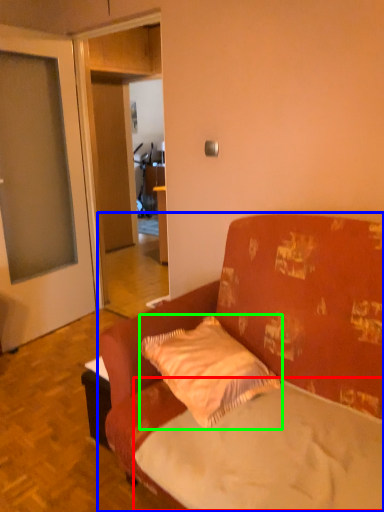
Question: Considering the real-world distances, which object is closest to mattress (highlighted by a red box)? studio couch (highlighted by a blue box) or pillow (highlighted by a green box).

Choices:
 (A) studio couch
 (B) pillow

Answer: (A)